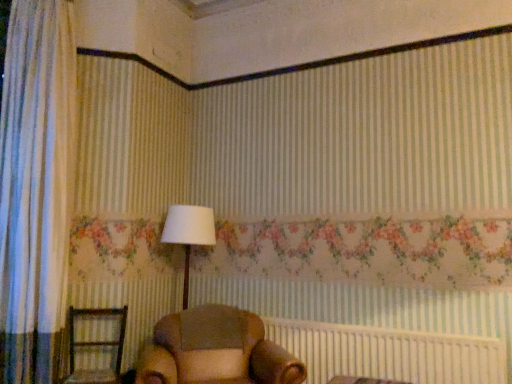
Where is `brown fabric bed frame at lower center`? Image resolution: width=512 pixels, height=384 pixels. brown fabric bed frame at lower center is located at coordinates (389, 353).

The height and width of the screenshot is (384, 512). What do you see at coordinates (215, 350) in the screenshot? I see `brown leather armchair at center, which is counted as the 1th furniture, starting from the right` at bounding box center [215, 350].

At what (x,y) coordinates should I click in order to perform the action: click on brown fabric bed frame at lower center. Please return your answer as a coordinate pair (x, y). Image resolution: width=512 pixels, height=384 pixels. Looking at the image, I should click on (389, 353).

Is white fabric lampshade at center aimed at brown fabric bed frame at lower center?

No, white fabric lampshade at center does not turn towards brown fabric bed frame at lower center.

The height and width of the screenshot is (384, 512). Find the location of `table lamp above the brown fabric bed frame at lower center (from a real-world perspective)`. table lamp above the brown fabric bed frame at lower center (from a real-world perspective) is located at coordinates (189, 234).

Is white fabric lampshade at center next to brown fabric bed frame at lower center?

white fabric lampshade at center and brown fabric bed frame at lower center are not in contact.

Between white fabric lampshade at center and brown fabric bed frame at lower center, which one appears on the right side from the viewer's perspective?

brown fabric bed frame at lower center is more to the right.

Can you confirm if brown leather armchair at center, which ranks as the second furniture in left-to-right order, is thinner than brown wooden chair at lower left, the 1th furniture positioned from the left?

Incorrect, the width of brown leather armchair at center, which ranks as the second furniture in left-to-right order, is not less than that of brown wooden chair at lower left, the 1th furniture positioned from the left.

Considering the relative positions of brown leather armchair at center, which ranks as the second furniture in left-to-right order, and brown wooden chair at lower left, the 1th furniture positioned from the left, in the image provided, is brown leather armchair at center, which ranks as the second furniture in left-to-right order, behind brown wooden chair at lower left, the 1th furniture positioned from the left,?

That is False.

Is brown leather armchair at center, which is counted as the 1th furniture, starting from the right, oriented towards brown wooden chair at lower left, which ranks as the 2th furniture in right-to-left order?

No, brown leather armchair at center, which is counted as the 1th furniture, starting from the right, is not oriented towards brown wooden chair at lower left, which ranks as the 2th furniture in right-to-left order.

From a real-world perspective, is brown leather armchair at center, which ranks as the second furniture in left-to-right order, physically below brown wooden chair at lower left, the 1th furniture positioned from the left?

Yes, from a real-world perspective, brown leather armchair at center, which ranks as the second furniture in left-to-right order, is under brown wooden chair at lower left, the 1th furniture positioned from the left.

Is white fabric lampshade at center looking in the opposite direction of brown leather armchair at center, which is counted as the 1th furniture, starting from the right?

white fabric lampshade at center is not turned away from brown leather armchair at center, which is counted as the 1th furniture, starting from the right.

Considering the sizes of objects white fabric lampshade at center and brown leather armchair at center, which is counted as the 1th furniture, starting from the right, in the image provided, who is wider, white fabric lampshade at center or brown leather armchair at center, which is counted as the 1th furniture, starting from the right,?

brown leather armchair at center, which is counted as the 1th furniture, starting from the right, is wider.

Looking at this image, what's the angular difference between white fabric lampshade at center and brown leather armchair at center, which is counted as the 1th furniture, starting from the right,'s facing directions?

4.14 degrees separate the facing orientations of white fabric lampshade at center and brown leather armchair at center, which is counted as the 1th furniture, starting from the right.

Can you confirm if white fabric lampshade at center is smaller than brown leather armchair at center, which ranks as the second furniture in left-to-right order?

Correct, white fabric lampshade at center occupies less space than brown leather armchair at center, which ranks as the second furniture in left-to-right order.

Can brown leather armchair at center, which is counted as the 1th furniture, starting from the right, be found inside brown wooden chair at lower left, which ranks as the 2th furniture in right-to-left order?

No.

From the image's perspective, would you say brown wooden chair at lower left, which ranks as the 2th furniture in right-to-left order, is shown under brown leather armchair at center, which ranks as the second furniture in left-to-right order?

Actually, brown wooden chair at lower left, which ranks as the 2th furniture in right-to-left order, appears above brown leather armchair at center, which ranks as the second furniture in left-to-right order, in the image.

Is brown wooden chair at lower left, the 1th furniture positioned from the left, far from brown leather armchair at center, which is counted as the 1th furniture, starting from the right?

They are positioned close to each other.

Considering the sizes of objects brown wooden chair at lower left, which ranks as the 2th furniture in right-to-left order, and brown leather armchair at center, which is counted as the 1th furniture, starting from the right, in the image provided, who is thinner, brown wooden chair at lower left, which ranks as the 2th furniture in right-to-left order, or brown leather armchair at center, which is counted as the 1th furniture, starting from the right,?

With smaller width is brown wooden chair at lower left, which ranks as the 2th furniture in right-to-left order.

In the scene shown: Is white fabric lampshade at center further to the viewer compared to brown wooden chair at lower left, the 1th furniture positioned from the left?

Yes, white fabric lampshade at center is further from the viewer.

From a real-world perspective, who is located lower, white fabric lampshade at center or brown wooden chair at lower left, which ranks as the 2th furniture in right-to-left order?

From a 3D spatial view, brown wooden chair at lower left, which ranks as the 2th furniture in right-to-left order, is below.

Can you see white fabric lampshade at center touching brown wooden chair at lower left, the 1th furniture positioned from the left?

No, white fabric lampshade at center is not making contact with brown wooden chair at lower left, the 1th furniture positioned from the left.

Which is more to the right, white fabric lampshade at center or brown wooden chair at lower left, which ranks as the 2th furniture in right-to-left order?

Positioned to the right is white fabric lampshade at center.

From the image's perspective, is brown fabric bed frame at lower center located above or below white fabric lampshade at center?

From the image's perspective, brown fabric bed frame at lower center appears below white fabric lampshade at center.

Identify the location of table lamp on the left of brown fabric bed frame at lower center. The image size is (512, 384). (189, 234).

Is brown fabric bed frame at lower center taller or shorter than white fabric lampshade at center?

Clearly, brown fabric bed frame at lower center is shorter compared to white fabric lampshade at center.

Is point (373, 340) behind point (184, 229)?

No, (373, 340) is in front of (184, 229).

Is the depth of brown wooden chair at lower left, which ranks as the 2th furniture in right-to-left order, greater than that of white fabric lampshade at center?

No, it is in front of white fabric lampshade at center.

Based on the photo, considering the sizes of brown wooden chair at lower left, the 1th furniture positioned from the left, and white fabric lampshade at center in the image, is brown wooden chair at lower left, the 1th furniture positioned from the left, bigger or smaller than white fabric lampshade at center?

brown wooden chair at lower left, the 1th furniture positioned from the left, is smaller than white fabric lampshade at center.

Does brown wooden chair at lower left, which ranks as the 2th furniture in right-to-left order, appear on the left side of white fabric lampshade at center?

Yes.

In order to click on table lamp that appears behind the brown fabric bed frame at lower center in this screenshot , I will do `click(189, 234)`.

You are a GUI agent. You are given a task and a screenshot of the screen. Output one action in this format:
    pyautogui.click(x=<x>, y=<y>)
    Task: Click on the furniture that appears on the right of brown wooden chair at lower left, which ranks as the 2th furniture in right-to-left order
    
    Given the screenshot: What is the action you would take?
    pyautogui.click(x=215, y=350)

From the picture: Looking at the image, which one is located closer to brown fabric bed frame at lower center, brown wooden chair at lower left, which ranks as the 2th furniture in right-to-left order, or white fabric lampshade at center?

The object closer to brown fabric bed frame at lower center is white fabric lampshade at center.

From the image, which object appears to be nearer to white fabric lampshade at center, brown leather armchair at center, which ranks as the second furniture in left-to-right order, or brown fabric bed frame at lower center?

brown leather armchair at center, which ranks as the second furniture in left-to-right order, lies closer to white fabric lampshade at center than the other object.

When comparing their distances from white fabric lampshade at center, does brown wooden chair at lower left, the 1th furniture positioned from the left, or brown fabric bed frame at lower center seem further?

Among the two, brown fabric bed frame at lower center is located further to white fabric lampshade at center.

When comparing their distances from white fabric lampshade at center, does brown leather armchair at center, which ranks as the second furniture in left-to-right order, or brown wooden chair at lower left, the 1th furniture positioned from the left, seem further?

brown wooden chair at lower left, the 1th furniture positioned from the left, is positioned further to the anchor white fabric lampshade at center.

Estimate the real-world distances between objects in this image. Which object is closer to brown wooden chair at lower left, the 1th furniture positioned from the left, brown fabric bed frame at lower center or brown leather armchair at center, which ranks as the second furniture in left-to-right order?

Among the two, brown leather armchair at center, which ranks as the second furniture in left-to-right order, is located nearer to brown wooden chair at lower left, the 1th furniture positioned from the left.

Estimate the real-world distances between objects in this image. Which object is closer to brown leather armchair at center, which ranks as the second furniture in left-to-right order, brown fabric bed frame at lower center or brown wooden chair at lower left, which ranks as the 2th furniture in right-to-left order?

Based on the image, brown fabric bed frame at lower center appears to be nearer to brown leather armchair at center, which ranks as the second furniture in left-to-right order.

Looking at the image, which one is located closer to brown wooden chair at lower left, the 1th furniture positioned from the left, white fabric lampshade at center or brown fabric bed frame at lower center?

white fabric lampshade at center.

From the image, which object appears to be farther from brown leather armchair at center, which is counted as the 1th furniture, starting from the right, brown fabric bed frame at lower center or white fabric lampshade at center?

white fabric lampshade at center is further to brown leather armchair at center, which is counted as the 1th furniture, starting from the right.

Find the location of a particular element. This screenshot has width=512, height=384. table lamp between brown wooden chair at lower left, the 1th furniture positioned from the left, and brown fabric bed frame at lower center from left to right is located at coordinates (189, 234).

You are a GUI agent. You are given a task and a screenshot of the screen. Output one action in this format:
    pyautogui.click(x=<x>, y=<y>)
    Task: Click on the furniture located between brown leather armchair at center, which is counted as the 1th furniture, starting from the right, and white fabric lampshade at center in the depth direction
    This screenshot has width=512, height=384.
    Given the screenshot: What is the action you would take?
    pyautogui.click(x=96, y=345)

Find the location of `furniture located between brown wooden chair at lower left, the 1th furniture positioned from the left, and brown fabric bed frame at lower center in the left-right direction`. furniture located between brown wooden chair at lower left, the 1th furniture positioned from the left, and brown fabric bed frame at lower center in the left-right direction is located at coordinates (215, 350).

Locate an element on the screen. furniture between white fabric lampshade at center and brown fabric bed frame at lower center is located at coordinates (215, 350).